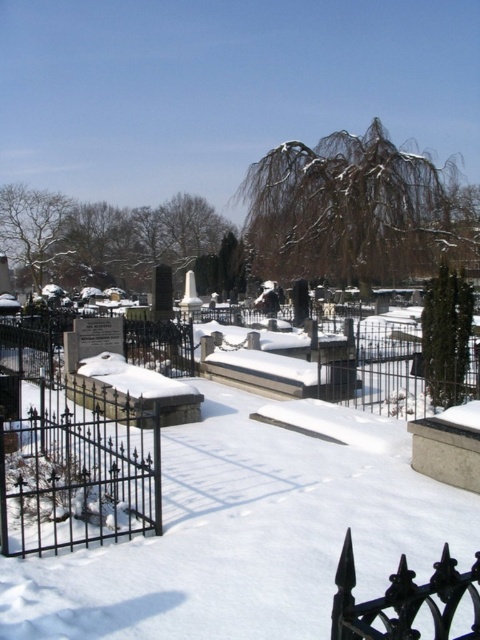
Question: Is the position of white powdery snow at center more distant than that of black wrought iron fence at lower left?

Choices:
 (A) no
 (B) yes

Answer: (A)

Question: Based on their relative distances, which object is farther from the black wrought iron fence at lower left?

Choices:
 (A) black wrought iron fence at lower right
 (B) white powdery snow at center

Answer: (A)

Question: Does black wrought iron fence at lower left appear over black wrought iron fence at lower right?

Choices:
 (A) yes
 (B) no

Answer: (B)

Question: Estimate the real-world distances between objects in this image. Which object is farther from the black wrought iron fence at lower left?

Choices:
 (A) black wrought iron fence at lower right
 (B) white powdery snow at center

Answer: (A)

Question: Among these points, which one is nearest to the camera?

Choices:
 (A) (24, 509)
 (B) (213, 525)
 (C) (339, 620)

Answer: (C)

Question: Is the position of white powdery snow at center more distant than that of black wrought iron fence at lower right?

Choices:
 (A) no
 (B) yes

Answer: (B)